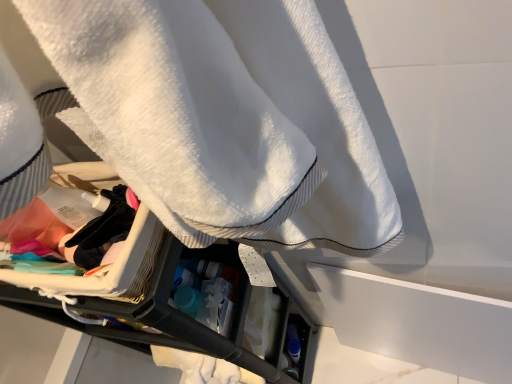
Question: Would you say white terry cloth towel at upper center is inside or outside black fabric at center?

Choices:
 (A) outside
 (B) inside

Answer: (A)

Question: Considering the positions of white terry cloth towel at upper center and black fabric at center in the image, is white terry cloth towel at upper center wider or thinner than black fabric at center?

Choices:
 (A) wide
 (B) thin

Answer: (A)

Question: Considering their positions, is white terry cloth towel at upper center located in front of or behind black fabric at center?

Choices:
 (A) front
 (B) behind

Answer: (A)

Question: From the image's perspective, is black fabric at center positioned above or below white terry cloth towel at upper center?

Choices:
 (A) above
 (B) below

Answer: (B)

Question: From their relative heights in the image, would you say black fabric at center is taller or shorter than white terry cloth towel at upper center?

Choices:
 (A) short
 (B) tall

Answer: (A)

Question: Considering the relative positions of black fabric at center and white terry cloth towel at upper center in the image provided, is black fabric at center to the left or to the right of white terry cloth towel at upper center?

Choices:
 (A) right
 (B) left

Answer: (B)

Question: Considering the positions of black fabric at center and white terry cloth towel at upper center in the image, is black fabric at center wider or thinner than white terry cloth towel at upper center?

Choices:
 (A) wide
 (B) thin

Answer: (B)